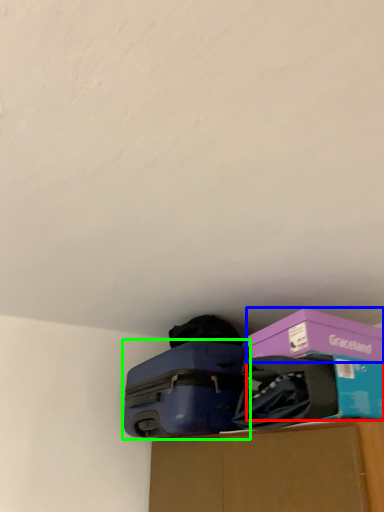
Question: Based on their relative distances, which object is farther from storage box (highlighted by a red box)? Choose from box (highlighted by a blue box) and suitcase (highlighted by a green box).

Choices:
 (A) box
 (B) suitcase

Answer: (B)